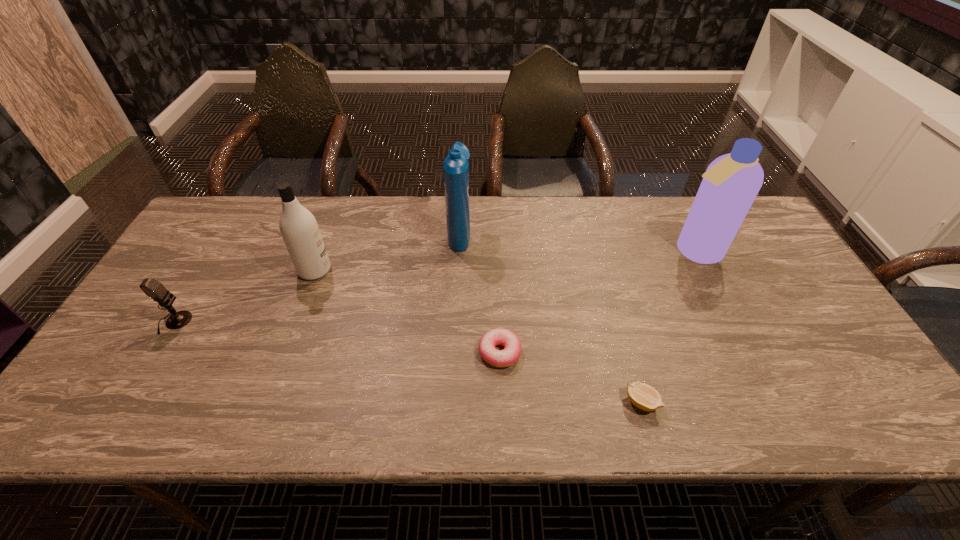
Locate an element on the screen. The image size is (960, 540). free space located 0.310m on the front-facing side of the fifth object from right to left is located at coordinates (440, 270).

Where is `vacant space located on the front-facing side of the third shortest object`? Image resolution: width=960 pixels, height=540 pixels. vacant space located on the front-facing side of the third shortest object is located at coordinates (283, 322).

This screenshot has height=540, width=960. I want to click on free space located on the left of the doughnut, so click(322, 352).

Locate an element on the screen. This screenshot has width=960, height=540. free region located on the left of the nearest object is located at coordinates (491, 403).

I want to click on object situated at the near edge, so click(x=643, y=396).

Locate an element on the screen. object that is positioned at the left edge is located at coordinates (151, 287).

Image resolution: width=960 pixels, height=540 pixels. I want to click on vacant space at the far edge of the desktop, so click(659, 208).

In the image, there is a desktop. Find the location of `vacant space at the near edge`. vacant space at the near edge is located at coordinates (417, 409).

In the image, there is a desktop. What are the coordinates of `vacant region at the left edge` in the screenshot? It's located at (193, 315).

At what (x,y) coordinates should I click in order to perform the action: click on free space at the right edge. Please return your answer as a coordinate pair (x, y). This screenshot has height=540, width=960. Looking at the image, I should click on (796, 310).